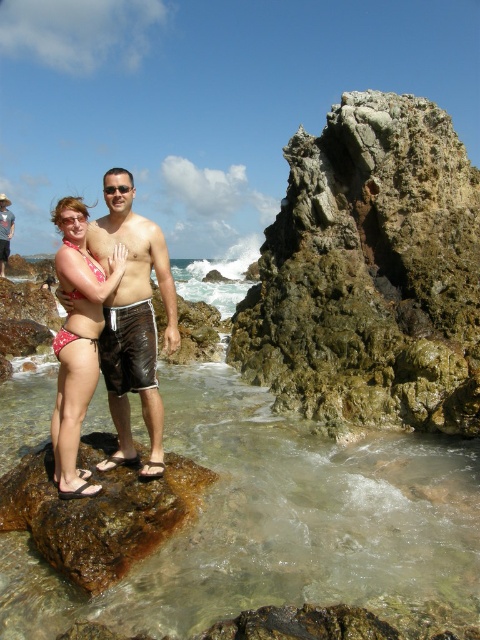
You are a snorkeler with a 3.5 meter long snorkel tube. You want to swim from the clear water at rock center to the brown rough rock at center to explore the underwater life. Can your tube allow you to reach the rock while keeping your head above water?

The clear water at rock center is 3.67 meters away from the brown rough rock at center. Since your snorkel tube is only 3.5 meters long, it is not long enough to reach the rock. You would need a longer tube to make the distance.

What object is located at the coordinates point (78, 340) in the beach scene?

The coordinates point (78, 340) corresponds to the printed bikini bottom at center.